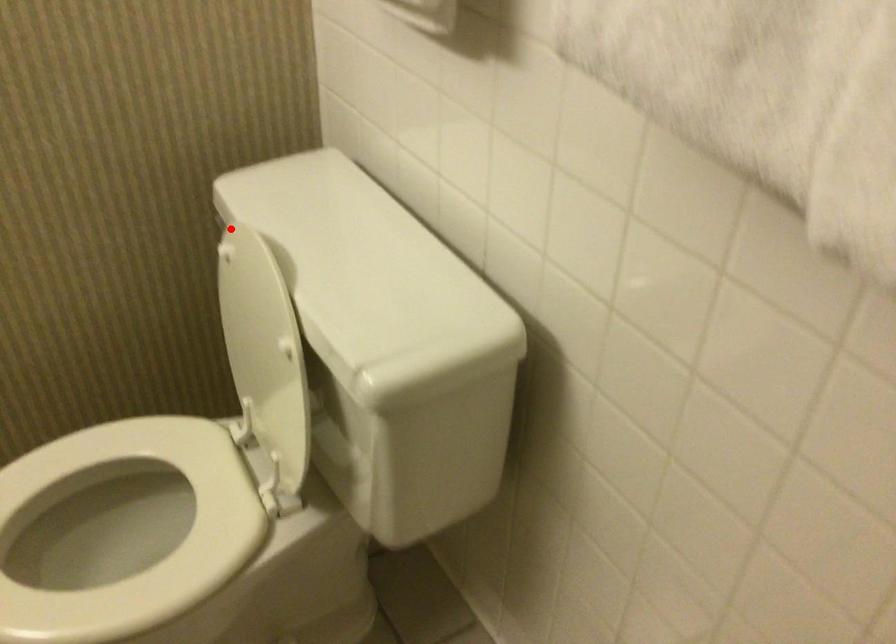
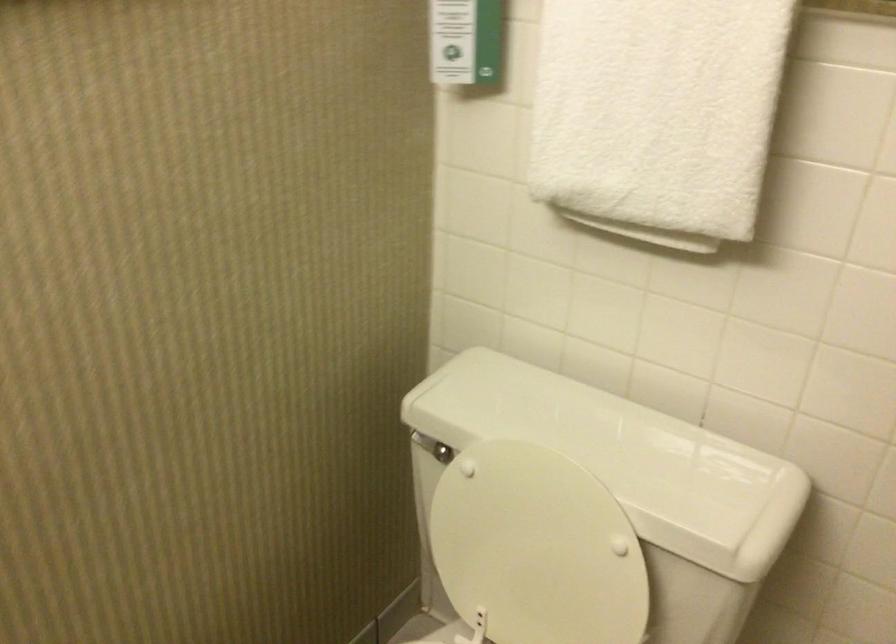
The point at the highlighted location is marked in the first image. Where is the corresponding point in the second image?

(425, 444)